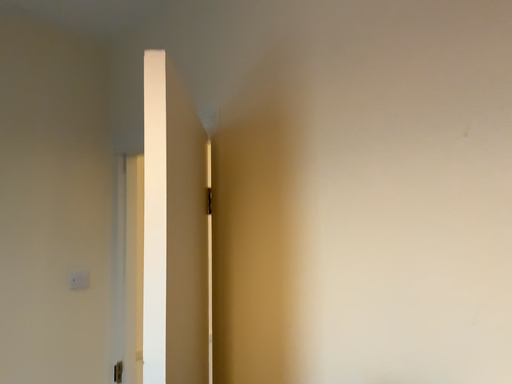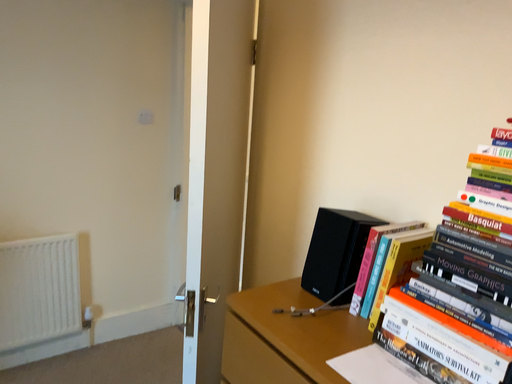
Question: Which way did the camera rotate in the video?

Choices:
 (A) rotated right
 (B) rotated left

Answer: (B)